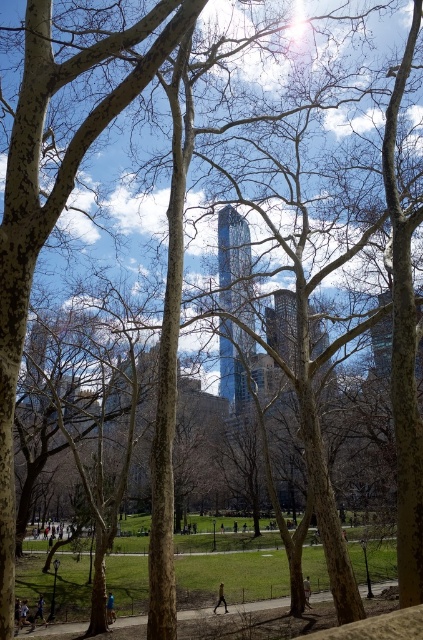
Between point (27, 612) and point (40, 616), which one is positioned in front?

Point (27, 612) is in front.

Describe the element at coordinates (22, 616) in the screenshot. I see `blue fabric person at lower left` at that location.

Is point (24, 614) more distant than point (35, 620)?

No.

At what (x,y) coordinates should I click in order to perform the action: click on blue fabric person at lower left. Please return your answer as a coordinate pair (x, y). Image resolution: width=423 pixels, height=640 pixels. Looking at the image, I should click on (22, 616).

Between smooth asphalt path at center and light brown leather jacket at lower center, which one appears on the left side from the viewer's perspective?

smooth asphalt path at center

In the scene shown: Which is more to the right, smooth asphalt path at center or light brown leather jacket at lower center?

Positioned to the right is light brown leather jacket at lower center.

Between point (392, 582) and point (307, 598), which one is positioned behind?

The point (392, 582) is more distant.

Identify the location of smooth asphalt path at center. The width and height of the screenshot is (423, 640). (57, 628).

Is smooth asphalt path at center smaller than blue fabric person at lower left?

Actually, smooth asphalt path at center might be larger than blue fabric person at lower left.

Locate an element on the screen. This screenshot has height=640, width=423. smooth asphalt path at center is located at coordinates (57, 628).

Describe the element at coordinates (57, 628) in the screenshot. This screenshot has height=640, width=423. I see `smooth asphalt path at center` at that location.

Where is `smooth asphalt path at center`? The image size is (423, 640). smooth asphalt path at center is located at coordinates (57, 628).